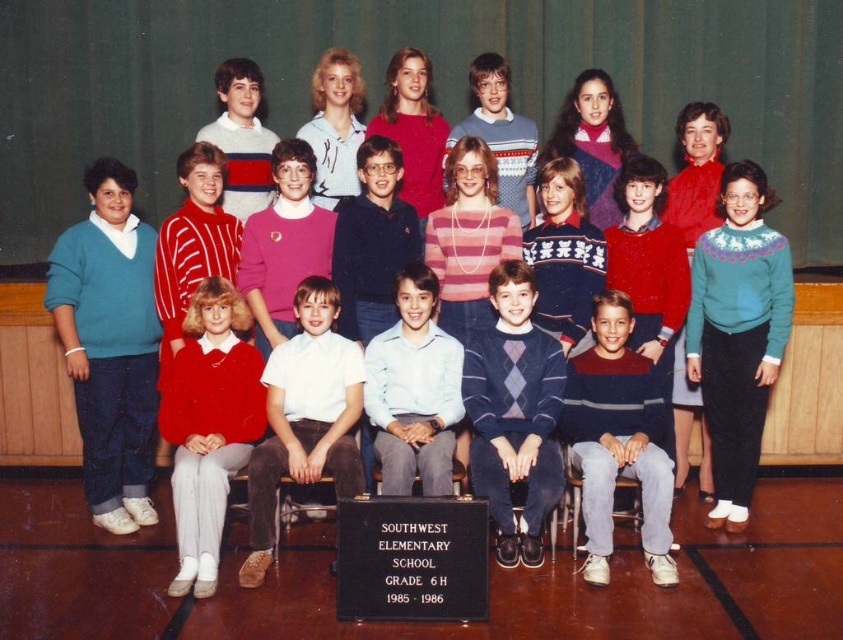
Who is lower down, teal sweater at left or light blue shirt at center?

light blue shirt at center is below.

Is point (58, 248) positioned in front of point (401, 442)?

No.

The image size is (843, 640). Find the location of `teal sweater at left`. teal sweater at left is located at coordinates (110, 344).

Is white cotton shirt at center positioned at the back of light blue shirt at center?

No.

Does point (309, 333) come behind point (384, 476)?

Yes, it is behind point (384, 476).

At what (x,y) coordinates should I click in order to perform the action: click on white cotton shirt at center. Please return your answer as a coordinate pair (x, y). Looking at the image, I should click on (305, 419).

Between black polished wood plaque at center and light blue shirt at center, which one has more height?

light blue shirt at center is taller.

Can you confirm if black polished wood plaque at center is shorter than light blue shirt at center?

Correct, black polished wood plaque at center is not as tall as light blue shirt at center.

At what (x,y) coordinates should I click in order to perform the action: click on black polished wood plaque at center. Please return your answer as a coordinate pair (x, y). This screenshot has width=843, height=640. Looking at the image, I should click on (411, 560).

Where is `black polished wood plaque at center`? black polished wood plaque at center is located at coordinates (411, 560).